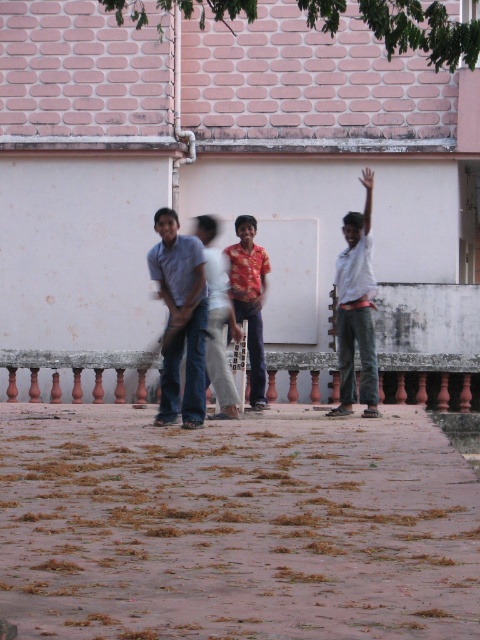
Question: Does brown dirt at lower center appear under white cotton pants at center?

Choices:
 (A) yes
 (B) no

Answer: (A)

Question: Which point appears farthest from the camera in this image?

Choices:
 (A) (178, 620)
 (B) (211, 246)
 (C) (360, 298)

Answer: (C)

Question: Does brown dirt at lower center come in front of white cotton pants at center?

Choices:
 (A) yes
 (B) no

Answer: (A)

Question: Which point is farther to the camera?

Choices:
 (A) white cotton pants at center
 (B) shiny red shirt at center
 (C) wooden balustrade at center
 (D) matte blue shirt at center

Answer: (C)

Question: Among these objects, which one is nearest to the camera?

Choices:
 (A) white cotton pants at center
 (B) white cotton shirt at right

Answer: (A)

Question: Does wooden balustrade at center appear on the left side of white cotton pants at center?

Choices:
 (A) no
 (B) yes

Answer: (A)